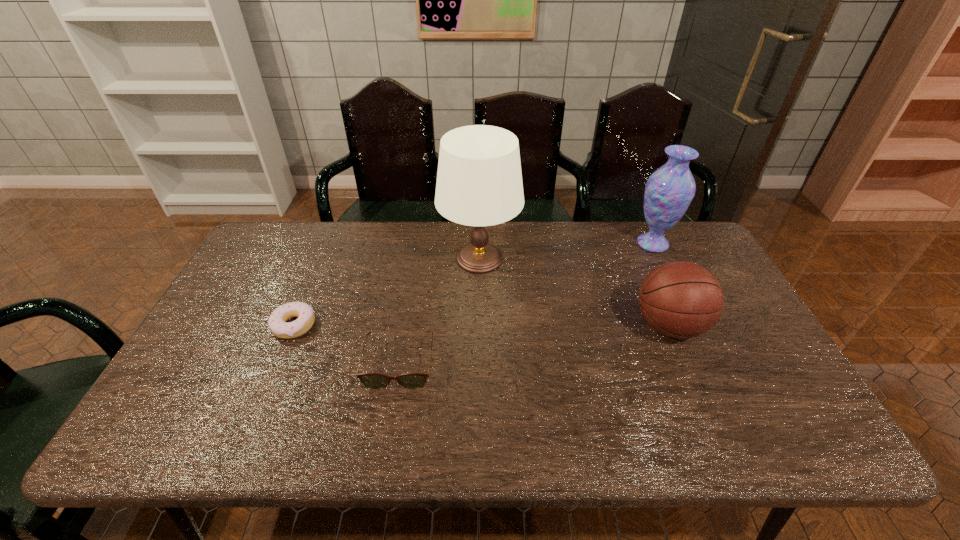
Locate which object is the closest to the lamp. Please provide its 2D coordinates. Your answer should be formatted as a tuple, i.e. [(x, y)], where the tuple contains the x and y coordinates of a point satisfying the conditions above.

[(370, 380)]

Find the location of a particular element. free location that satisfies the following two spatial constraints: 1. on the back side of the tallest object; 2. on the left side of the fourth shortest object is located at coordinates (480, 244).